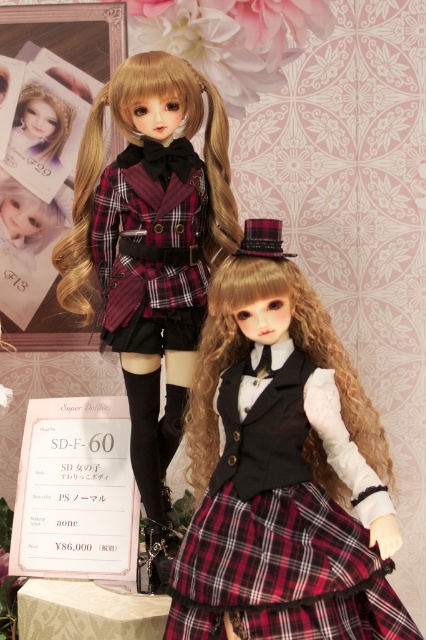
Question: Which point is closer to the camera?

Choices:
 (A) matte black doll at upper left
 (B) plaid fabric dress at center
 (C) plaid fabric skirt at center

Answer: (C)

Question: Is plaid fabric dress at center above matte black doll at upper left?

Choices:
 (A) yes
 (B) no

Answer: (B)

Question: Is plaid fabric dress at center smaller than plaid fabric skirt at center?

Choices:
 (A) yes
 (B) no

Answer: (B)

Question: Which point is closer to the camera?

Choices:
 (A) (262, 381)
 (B) (164, 280)
 (C) (141, 332)
 (D) (282, 540)

Answer: (D)

Question: Which object is positioned closest to the plaid fabric dress at center?

Choices:
 (A) black plaid kilt at center
 (B) matte black doll at upper left

Answer: (B)

Question: Does plaid fabric dress at center appear on the right side of black plaid kilt at center?

Choices:
 (A) yes
 (B) no

Answer: (A)